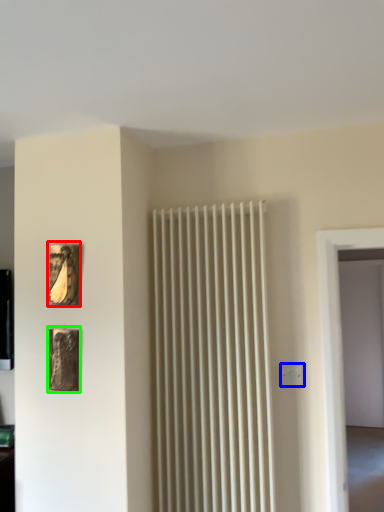
Question: Which is nearer to the picture frame (highlighted by a red box)? electric outlet (highlighted by a blue box) or picture frame (highlighted by a green box).

Choices:
 (A) electric outlet
 (B) picture frame

Answer: (B)